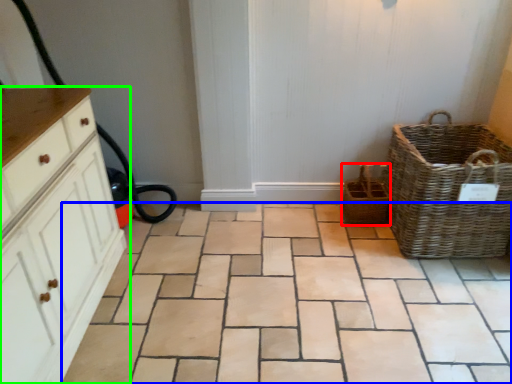
Question: Which object is positioned closest to basket (highlighted by a red box)? Select from ceramic tile (highlighted by a blue box) and chest of drawers (highlighted by a green box).

Choices:
 (A) ceramic tile
 (B) chest of drawers

Answer: (A)